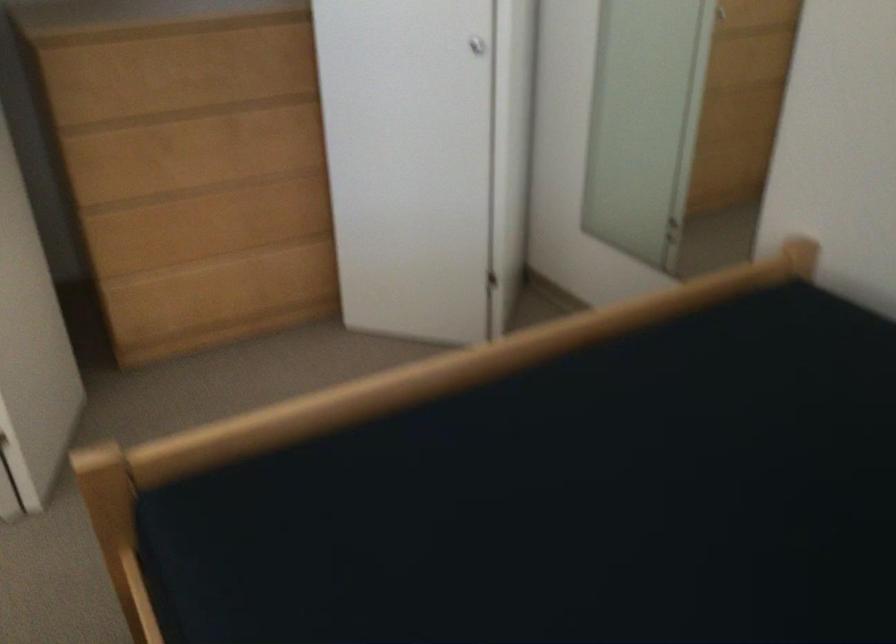
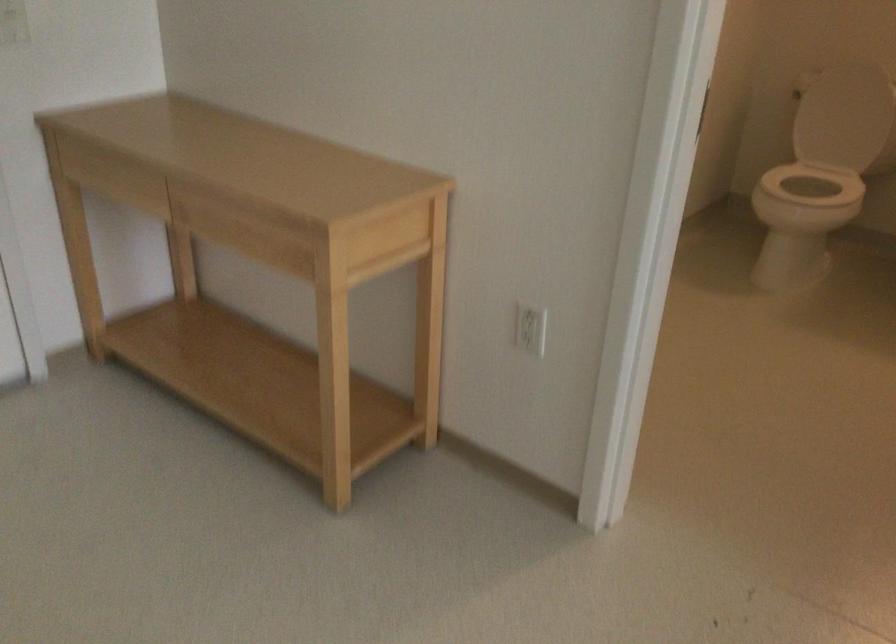
Which direction would the cameraman need to move to produce the second image?

The cameraman moved toward left, forward.